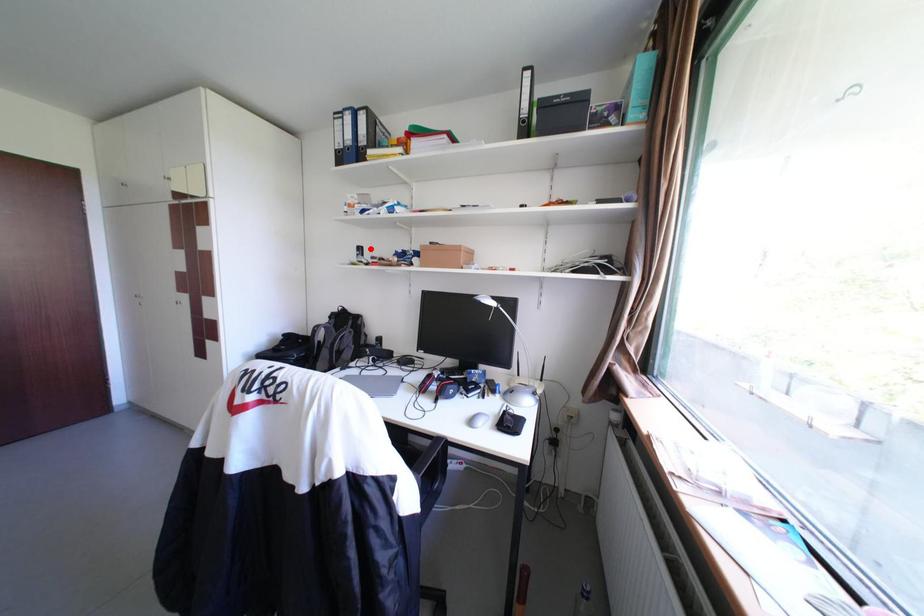
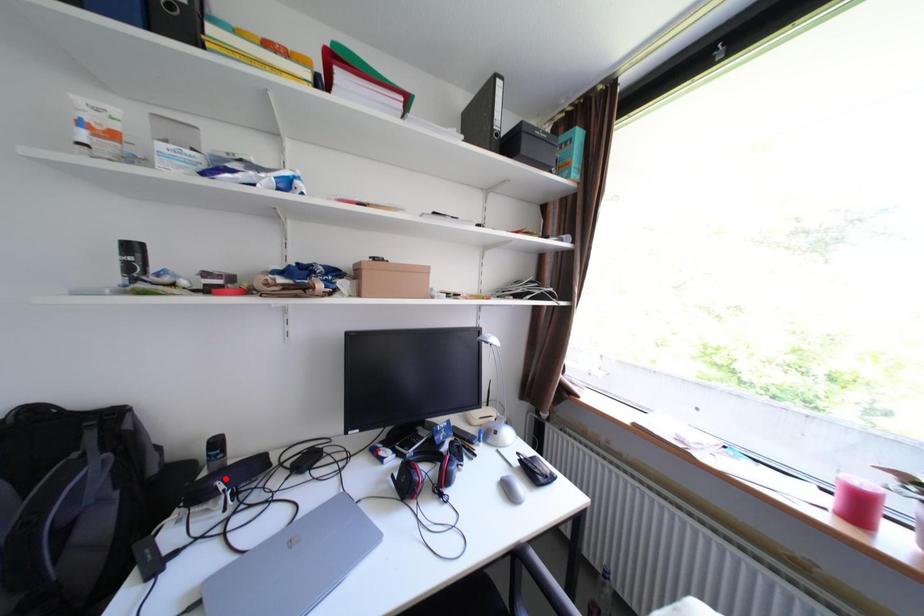
I am providing you with two images of the same scene from different viewpoints. A red point is marked on the first image and another point is marked on the second image. Is the red point in image1 aligned with the point shown in image2?

No